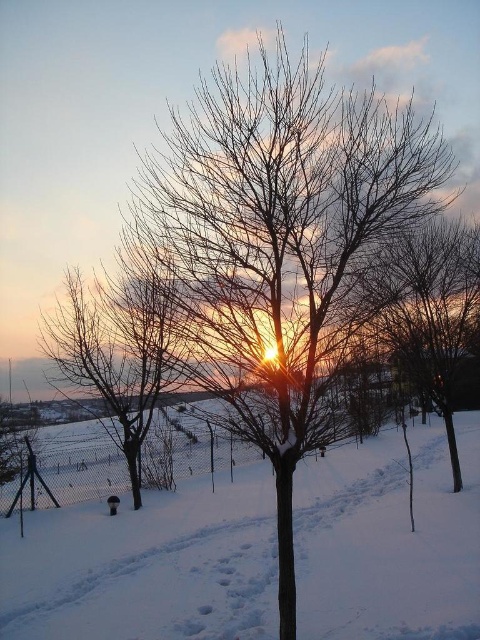
Question: Is white powdery snow at center thinner than bare branches at center?

Choices:
 (A) yes
 (B) no

Answer: (B)

Question: Is brown/dry wood tree at center closer to the viewer compared to white powdery snow at center?

Choices:
 (A) yes
 (B) no

Answer: (B)

Question: Estimate the real-world distances between objects in this image. Which object is closer to the bare branches at center?

Choices:
 (A) brown/dry wood tree at center
 (B) white powdery snow at center

Answer: (B)

Question: Among these objects, which one is farthest from the camera?

Choices:
 (A) white powdery snow at center
 (B) bare branches at center
 (C) brown/dry wood tree at center

Answer: (B)

Question: Does brown/dry wood tree at center have a greater width compared to bare branches at center?

Choices:
 (A) yes
 (B) no

Answer: (A)

Question: Which point is farther to the camera?

Choices:
 (A) bare branches at center
 (B) brown/dry wood tree at center

Answer: (A)